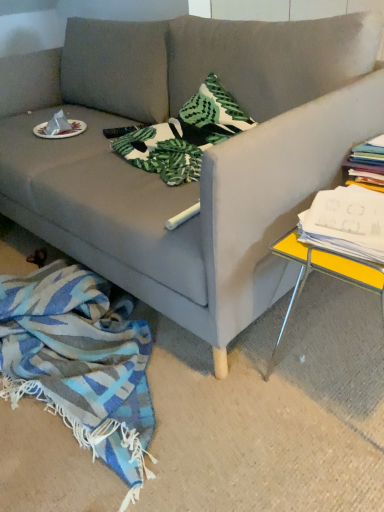
Question: Could you tell me if matte gray couch at center is turned towards white paper stack at right?

Choices:
 (A) no
 (B) yes

Answer: (A)

Question: Is matte gray couch at center shorter than white paper stack at right?

Choices:
 (A) no
 (B) yes

Answer: (A)

Question: Is the depth of matte gray couch at center less than that of white paper stack at right?

Choices:
 (A) no
 (B) yes

Answer: (B)

Question: Is matte gray couch at center bigger than white paper stack at right?

Choices:
 (A) no
 (B) yes

Answer: (B)

Question: Are matte gray couch at center and white paper stack at right making contact?

Choices:
 (A) no
 (B) yes

Answer: (A)

Question: In the image, is white paper plate at upper left positioned in front of or behind matte gray couch at center?

Choices:
 (A) behind
 (B) front

Answer: (A)

Question: Considering the positions of white paper plate at upper left and matte gray couch at center in the image, is white paper plate at upper left wider or thinner than matte gray couch at center?

Choices:
 (A) thin
 (B) wide

Answer: (A)

Question: Considering the positions of point click(36, 130) and point click(168, 284), is point click(36, 130) closer or farther from the camera than point click(168, 284)?

Choices:
 (A) closer
 (B) farther

Answer: (B)

Question: Visually, is white paper plate at upper left positioned to the left or to the right of matte gray couch at center?

Choices:
 (A) right
 (B) left

Answer: (B)

Question: Considering the positions of point (334, 230) and point (365, 265), is point (334, 230) closer or farther from the camera than point (365, 265)?

Choices:
 (A) closer
 (B) farther

Answer: (B)

Question: Based on their sizes in the image, would you say white paper stack at right is bigger or smaller than yellow metallic table at right?

Choices:
 (A) big
 (B) small

Answer: (B)

Question: Based on their positions, is white paper stack at right located to the left or right of yellow metallic table at right?

Choices:
 (A) left
 (B) right

Answer: (A)

Question: Is white paper stack at right in front of or behind yellow metallic table at right in the image?

Choices:
 (A) behind
 (B) front

Answer: (A)

Question: From a real-world perspective, is yellow metallic table at right physically located above or below blue woven blanket at lower left?

Choices:
 (A) below
 (B) above

Answer: (B)

Question: From the image's perspective, is yellow metallic table at right above or below blue woven blanket at lower left?

Choices:
 (A) above
 (B) below

Answer: (A)